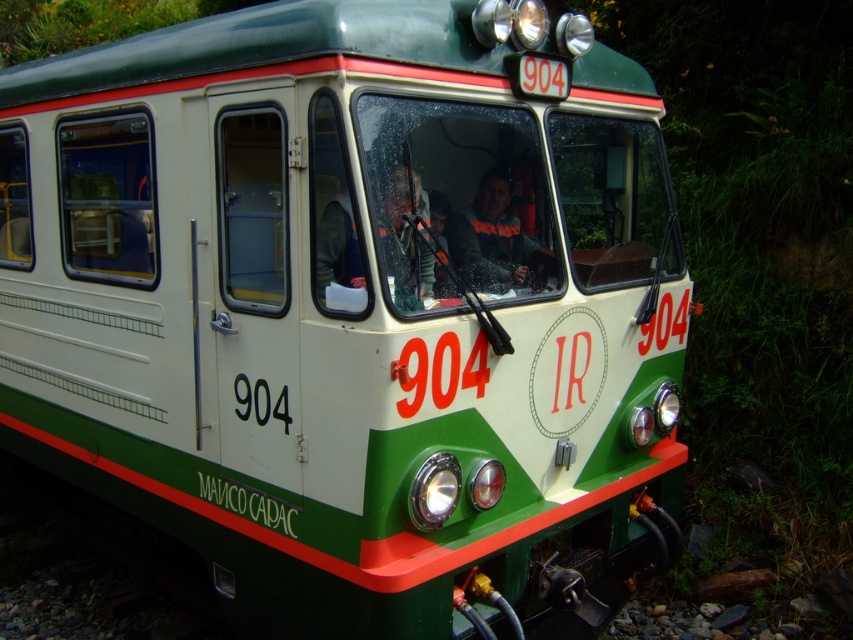
Question: Which point appears farthest from the camera in this image?

Choices:
 (A) (482, 234)
 (B) (422, 212)

Answer: (A)

Question: Which point is closer to the camera?

Choices:
 (A) (451, 248)
 (B) (328, 211)

Answer: (B)

Question: Is matte black jacket at center bigger than dark gray fabric jacket at center?

Choices:
 (A) yes
 (B) no

Answer: (B)

Question: Which of the following is the farthest from the observer?

Choices:
 (A) dark gray fabric jacket at center
 (B) matte black jacket at center

Answer: (A)

Question: Can you confirm if matte black jacket at center is positioned below dark gray fabric jacket at center?

Choices:
 (A) no
 (B) yes

Answer: (B)

Question: Is matte black jacket at center to the right of dark gray fabric jacket at center from the viewer's perspective?

Choices:
 (A) no
 (B) yes

Answer: (A)